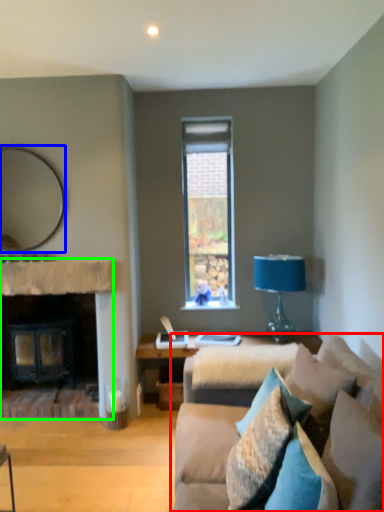
Question: Considering the real-world distances, which object is closest to studio couch (highlighted by a red box)? mirror (highlighted by a blue box) or fireplace (highlighted by a green box).

Choices:
 (A) mirror
 (B) fireplace

Answer: (B)